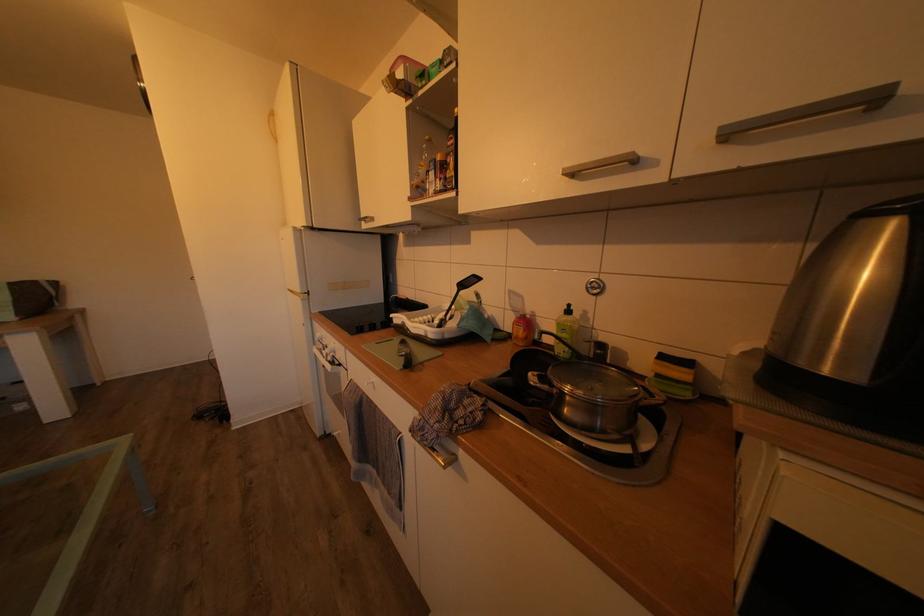
Which object does [675,376] point to?

It corresponds to the yellow and green sponge in the image.